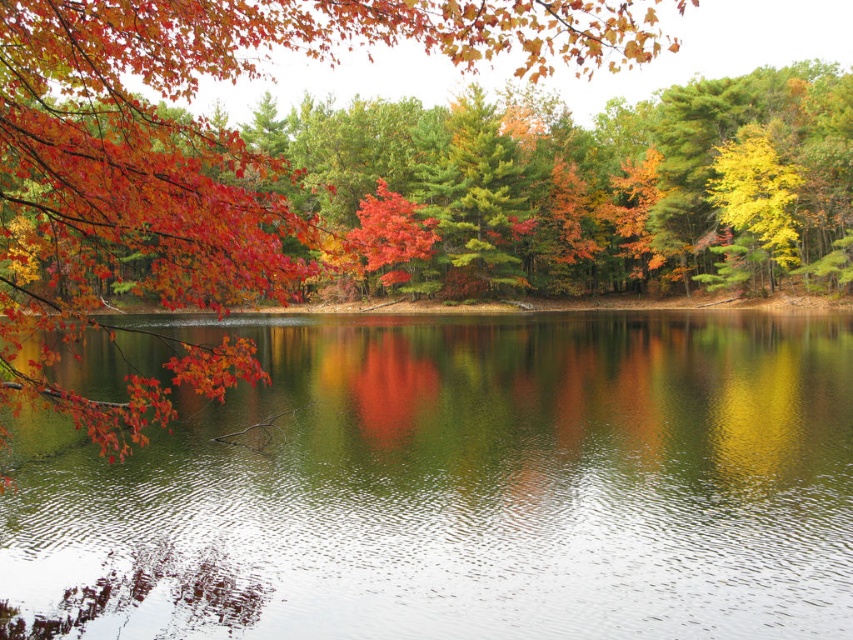
You are standing at the lakeside and want to take a photo of the shiny red leaves at upper left and the green reflective water at center. Which object will appear closer to the camera in the photo?

The green reflective water at center will appear closer to the camera in the photo because the shiny red leaves at upper left are positioned behind it.

You are standing by the water and want to take a photo of both the green reflective water at center and the shiny red leaves at upper left. Which object should you zoom in on to ensure both fit in the frame?

The green reflective water at center has a smaller size compared to shiny red leaves at upper left, so you should zoom in on the shiny red leaves at upper left to ensure both fit in the frame.

You are standing at the edge of the water in the autumn scene. There are two points marked in the image. Which point, point (463, 394) or point (218, 300), is closer to your current position?

Point (218, 300) is closer to your current position because it is nearer to the viewer than point (463, 394), which is further away.